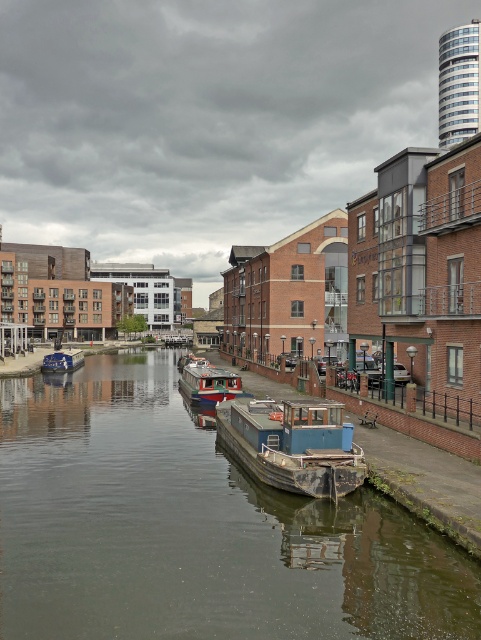
You are a GUI agent. You are given a task and a screenshot of the screen. Output one action in this format:
    pyautogui.click(x=<x>, y=<y>)
    Task: Click on the smooth concrete river at center
    This screenshot has height=640, width=481.
    Given the screenshot: What is the action you would take?
    pyautogui.click(x=194, y=529)

Measure the distance between smooth concrete river at center and blue weathered barge at center.

The distance of smooth concrete river at center from blue weathered barge at center is 3.15 meters.

Does point (235, 563) come closer to viewer compared to point (328, 419)?

Yes, it is.

In order to click on smooth concrete river at center in this screenshot , I will do `click(194, 529)`.

Which is below, blue weathered barge at center or red glossy boat at center?

Positioned lower is red glossy boat at center.

Can you confirm if blue weathered barge at center is thinner than red glossy boat at center?

Yes.

What are the coordinates of `blue weathered barge at center` in the screenshot? It's located at (293, 445).

Identify the location of blue weathered barge at center. This screenshot has height=640, width=481. (293, 445).

Is smooth concrete river at center positioned in front of blue matte barge at center?

Yes, smooth concrete river at center is in front of blue matte barge at center.

Between smooth concrete river at center and blue matte barge at center, which one is positioned lower?

smooth concrete river at center

Which is in front, point (162, 538) or point (74, 349)?

Positioned in front is point (162, 538).

What are the coordinates of `smooth concrete river at center` in the screenshot? It's located at (194, 529).